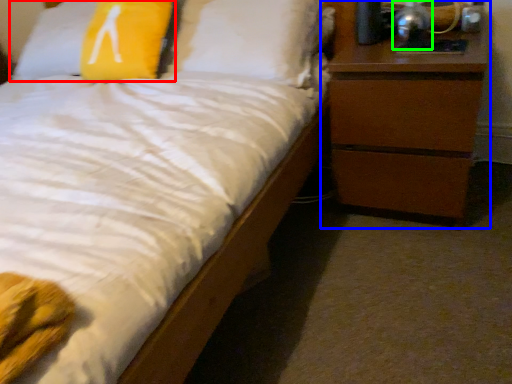
Question: Which is nearer to the pillow (highlighted by a red box)? chest of drawers (highlighted by a blue box) or bedside lamp (highlighted by a green box).

Choices:
 (A) chest of drawers
 (B) bedside lamp

Answer: (A)